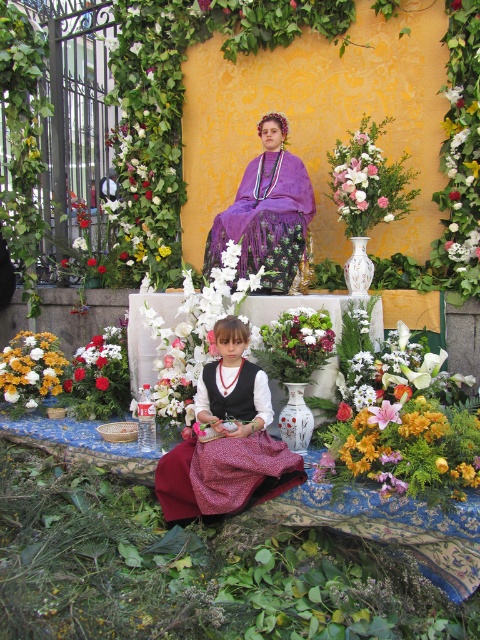
Can you confirm if purple satin dress at center is positioned above white glossy vase at center?

Yes, purple satin dress at center is above white glossy vase at center.

Does purple satin dress at center appear under white glossy vase at center?

Actually, purple satin dress at center is above white glossy vase at center.

This screenshot has height=640, width=480. I want to click on purple satin dress at center, so click(266, 212).

Between polka dot fabric dress at lower center and purple satin dress at center, which one appears on the left side from the viewer's perspective?

From the viewer's perspective, polka dot fabric dress at lower center appears more on the left side.

Which is behind, point (231, 433) or point (257, 262)?

The point (257, 262) is more distant.

I want to click on polka dot fabric dress at lower center, so click(228, 440).

Does white glossy vase at center appear under matte yellow flowers at lower left?

No.

Which is behind, point (219, 301) or point (23, 372)?

Point (23, 372)

You are a GUI agent. You are given a task and a screenshot of the screen. Output one action in this format:
    pyautogui.click(x=<x>, y=<y>)
    Task: Click on the white glossy vase at center
    Image resolution: width=480 pixels, height=640 pixels.
    Given the screenshot: What is the action you would take?
    pyautogui.click(x=193, y=336)